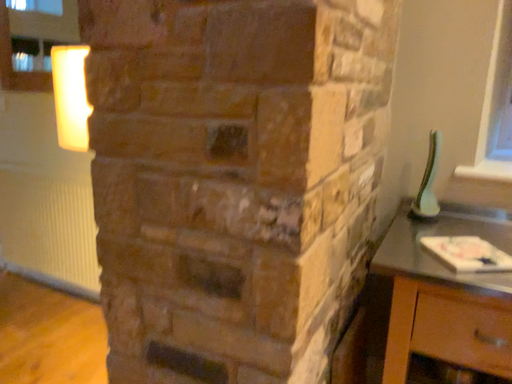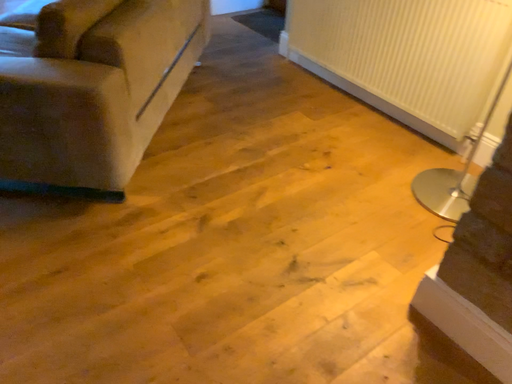
Question: Which way did the camera rotate in the video?

Choices:
 (A) rotated left
 (B) rotated right

Answer: (A)